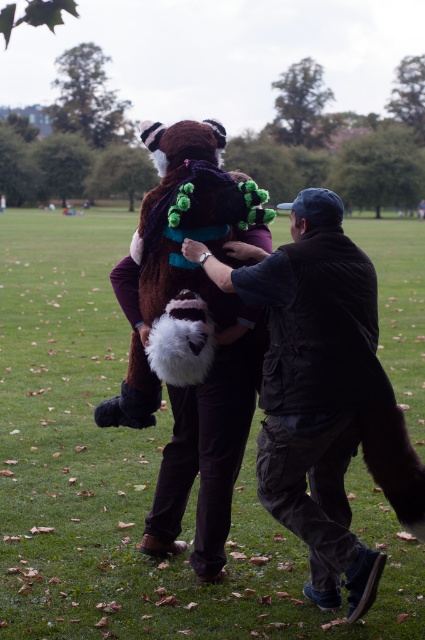
You are standing in the park and see the dark brown leather jacket at center and the brown plush animal at center. Which object is positioned to the right of the other?

The dark brown leather jacket at center is to the right of the brown plush animal at center.

You are a photographer trying to capture the scene of the dark brown leather jacket at center and the brown plush animal at center. Which object is closer to the camera?

The dark brown leather jacket at center is positioned under the brown plush animal at center, so the dark brown leather jacket at center is closer to the camera.

You are standing in the park and see the point marked at coordinates [323,394]. What object is located at that point?

The point at [323,394] marks the location of the dark brown leather jacket at center.